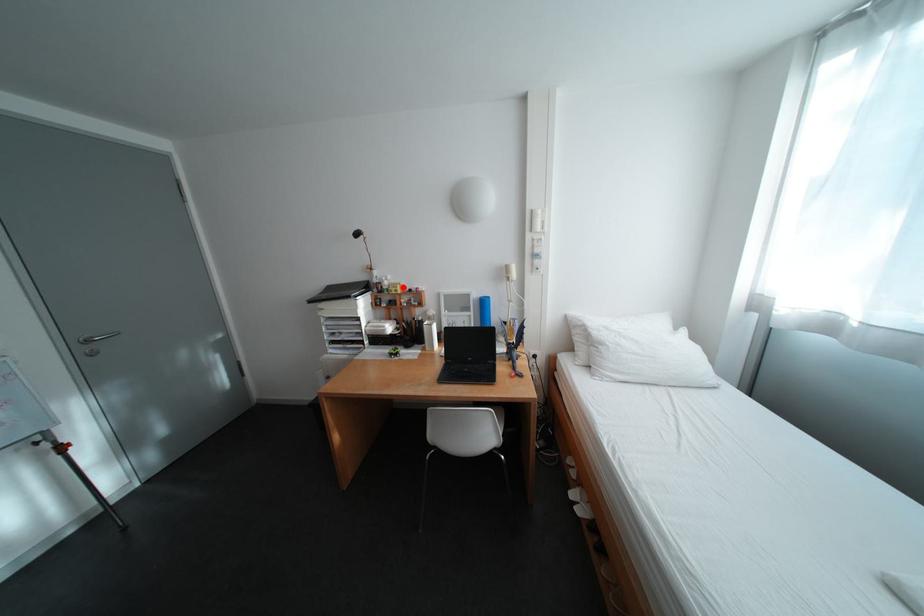
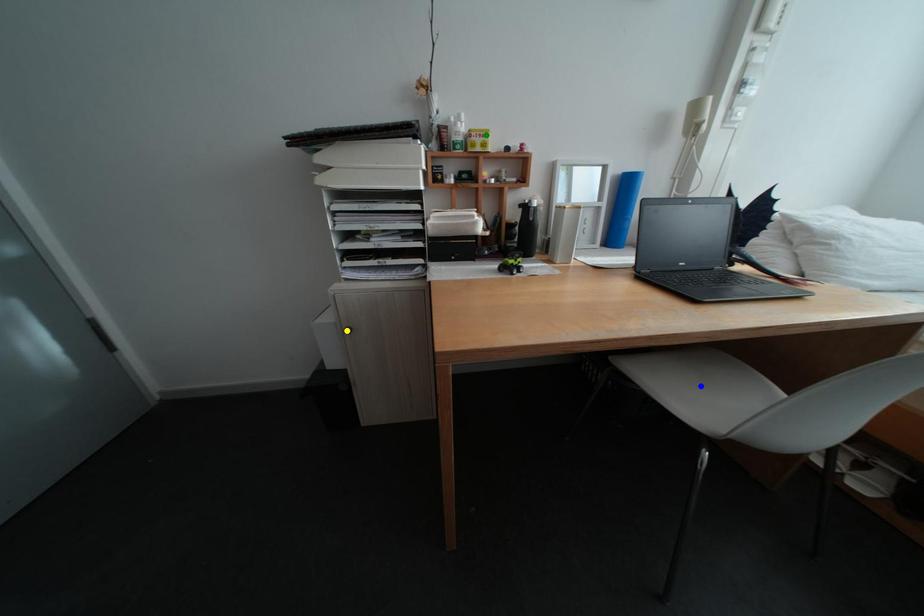
Question: I am providing you with two images of the same scene from different viewpoints. A red point is marked on the first image. You are given multiple points on the second image. Can you choose the point in image 2 that corresponds to the point in image 1?

Choices:
 (A) blue point
 (B) green point
 (C) yellow point

Answer: (B)